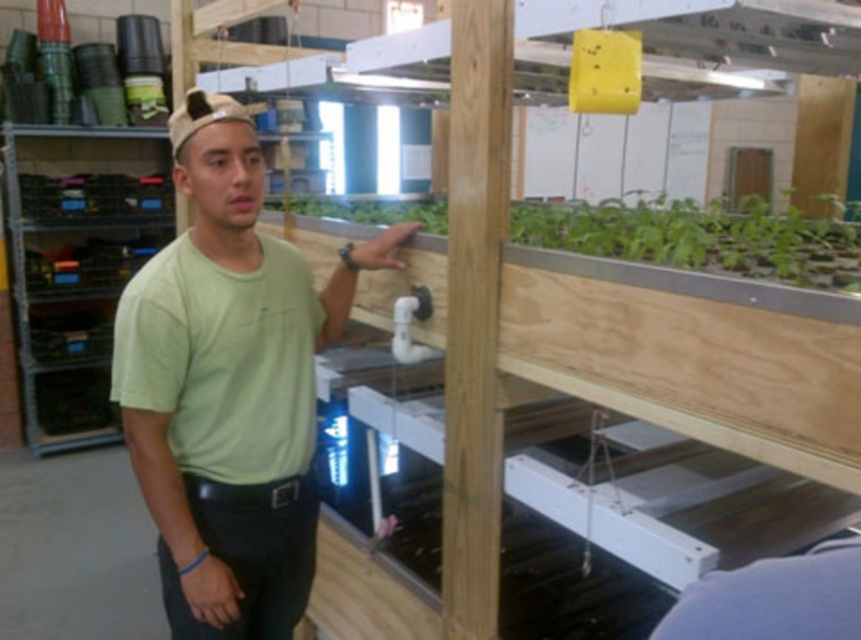
You are standing in the greenhouse and want to place a new plant tray between the two points, point (248, 166) and point (574, 244). Which point should the tray be closer to in order to be placed behind the second point?

The tray should be closer to point (574, 244) to be placed behind point (574, 244) since point (248, 166) is behind it.